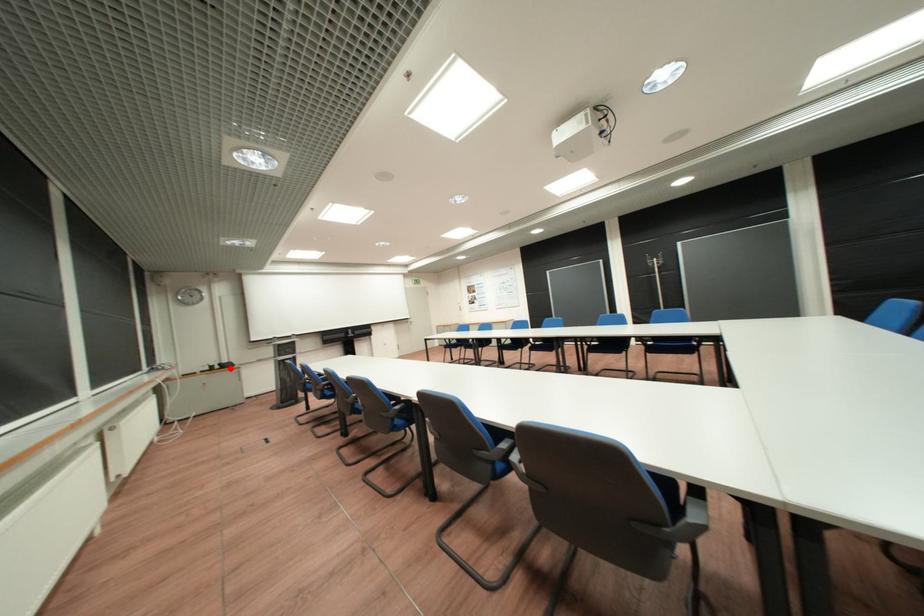
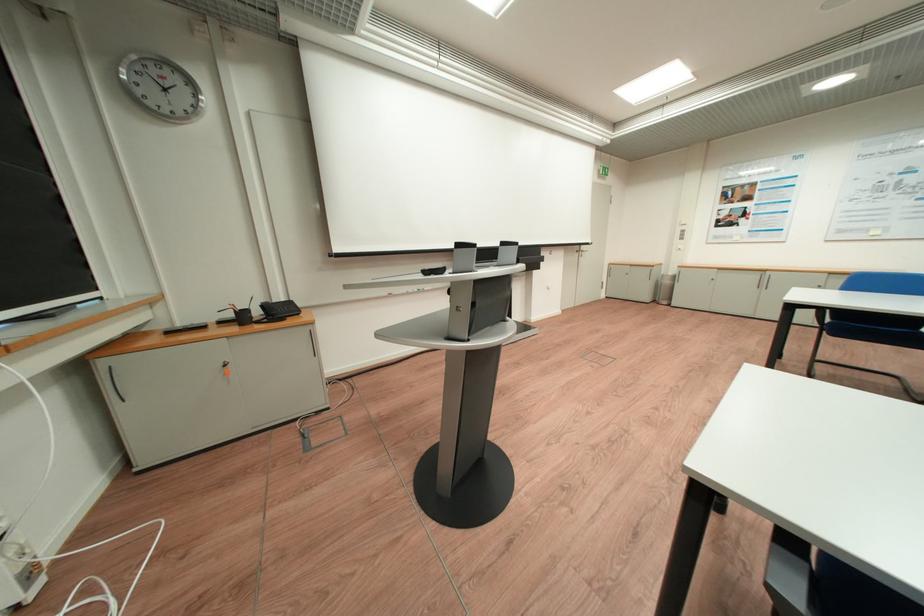
Where in the second image is the point corresponding to the highlighted location from the first image?

(271, 314)